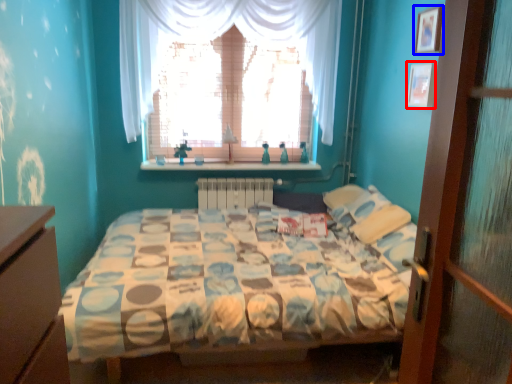
Question: Which object is further to the camera taking this photo, picture frame (highlighted by a red box) or picture frame (highlighted by a blue box)?

Choices:
 (A) picture frame
 (B) picture frame

Answer: (A)